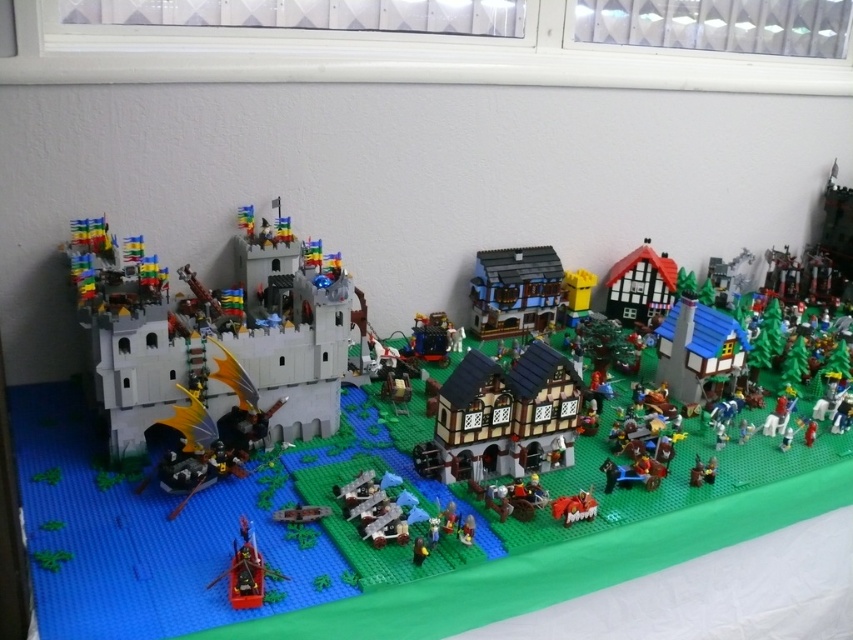
In the scene shown: Between white matte castle at left and shiny red boat at lower left, which one is positioned higher?

white matte castle at left is higher up.

Where is `white matte castle at left`? This screenshot has width=853, height=640. white matte castle at left is located at coordinates (207, 339).

You are a GUI agent. You are given a task and a screenshot of the screen. Output one action in this format:
    pyautogui.click(x=<x>, y=<y>)
    Task: Click on the white matte castle at left
    
    Given the screenshot: What is the action you would take?
    pyautogui.click(x=207, y=339)

Does wooden house at center lie behind shiny red boat at lower left?

Yes, it is.

Does point (553, 269) lie behind point (252, 589)?

That is True.

Does point (549, 269) lie behind point (247, 580)?

Yes, it is.

Find the location of a particular element. Image resolution: width=853 pixels, height=640 pixels. wooden house at center is located at coordinates (514, 291).

Between brown/timbered house at center and shiny red boat at lower left, which one has more height?

With more height is brown/timbered house at center.

Is point (514, 410) farther from viewer compared to point (245, 541)?

Yes, it is.

I want to click on brown/timbered house at center, so click(x=505, y=417).